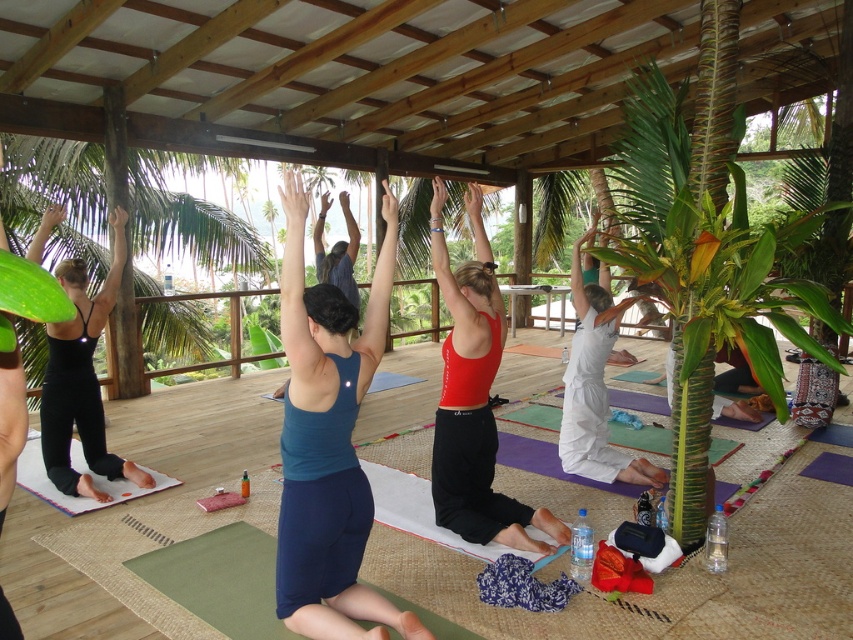
You are a photographer standing outside the wooden pavilion and want to capture both the black matte yoga pants at left and the white cotton yoga pants at lower right in a single photo. Which of the two should you focus on first to ensure they are both in the frame?

The black matte yoga pants at left is located below the white cotton yoga pants at lower right, so you should focus on the white cotton yoga pants at lower right first to ensure both are within the frame.

You are a yoga instructor observing the class. You notice the blue fabric yoga mat at center and the black matte yoga pants at left. Which object appears taller in the image?

The blue fabric yoga mat at center appears much taller than the black matte yoga pants at left.